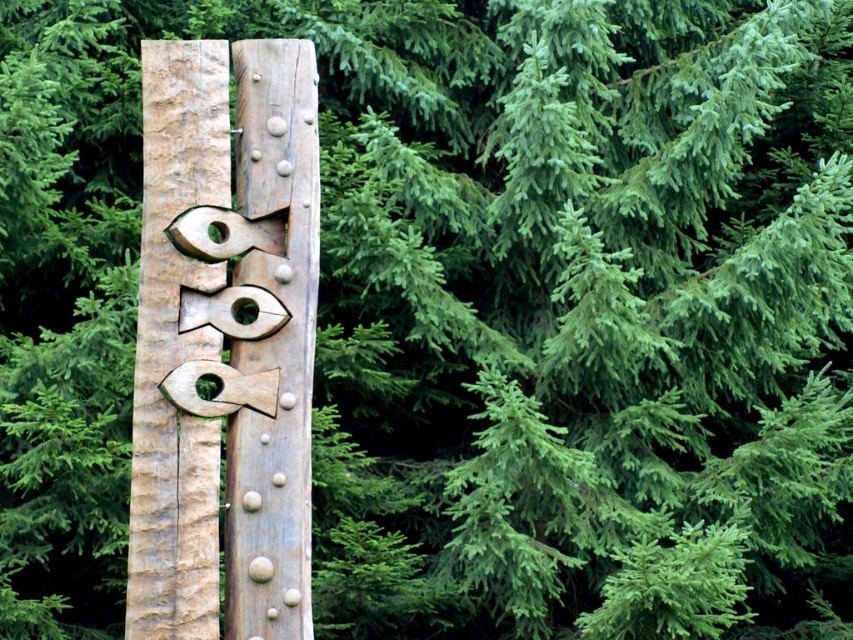
You are an artist planning to paint a scene based on the image. You need to ensure the proportions between the natural wood totem pole at center and the wooden totem pole at center are accurate. Which one should you depict as wider?

The natural wood totem pole at center should be depicted as wider since its width surpasses that of the wooden totem pole at center.